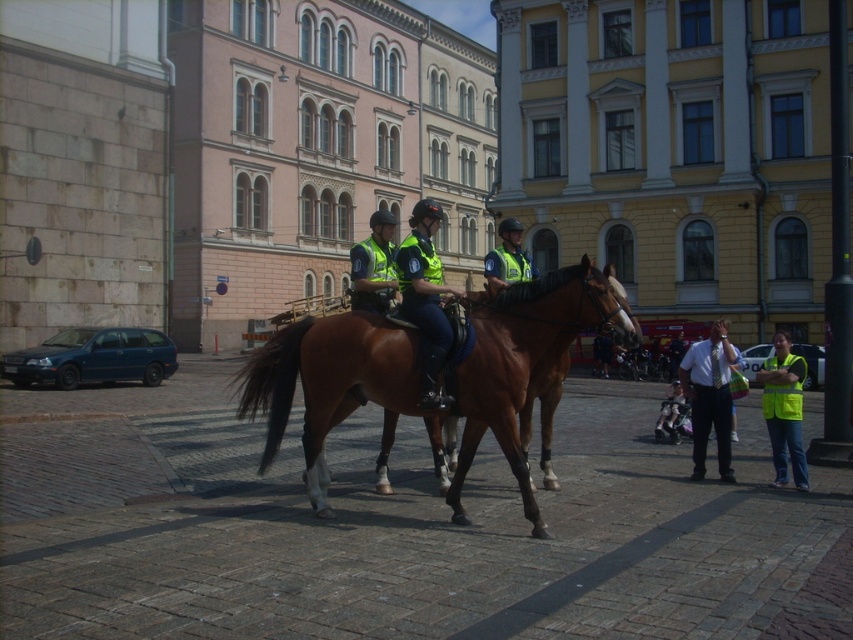
Does brown glossy horse at center appear on the left side of reflective green uniform at center?

In fact, brown glossy horse at center is to the right of reflective green uniform at center.

Which is more to the left, brown glossy horse at center or reflective green uniform at center?

reflective green uniform at center is more to the left.

The height and width of the screenshot is (640, 853). Find the location of `brown glossy horse at center`. brown glossy horse at center is located at coordinates (328, 381).

Can you confirm if reflective green uniform at center is thinner than neon yellow vest at lower right?

Yes, reflective green uniform at center is thinner than neon yellow vest at lower right.

Is reflective green uniform at center above neon yellow vest at lower right?

Yes, reflective green uniform at center is above neon yellow vest at lower right.

Is point (451, 332) positioned before point (764, 388)?

That is True.

Locate an element on the screen. reflective green uniform at center is located at coordinates (425, 296).

Is light blue shirt with tie at center shorter than reflective yellow vest at center?

Correct, light blue shirt with tie at center is not as tall as reflective yellow vest at center.

The image size is (853, 640). What do you see at coordinates (709, 397) in the screenshot? I see `light blue shirt with tie at center` at bounding box center [709, 397].

The width and height of the screenshot is (853, 640). I want to click on light blue shirt with tie at center, so click(709, 397).